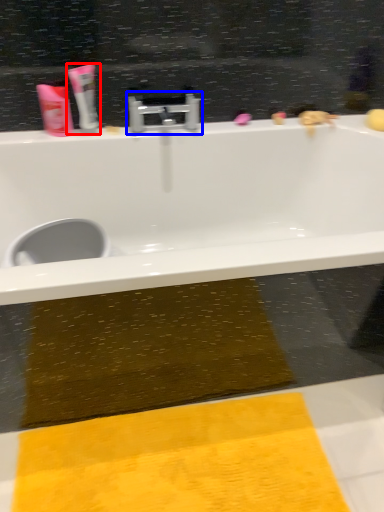
Question: Which object is closer to the camera taking this photo, toothpaste (highlighted by a red box) or tap (highlighted by a blue box)?

Choices:
 (A) toothpaste
 (B) tap

Answer: (A)